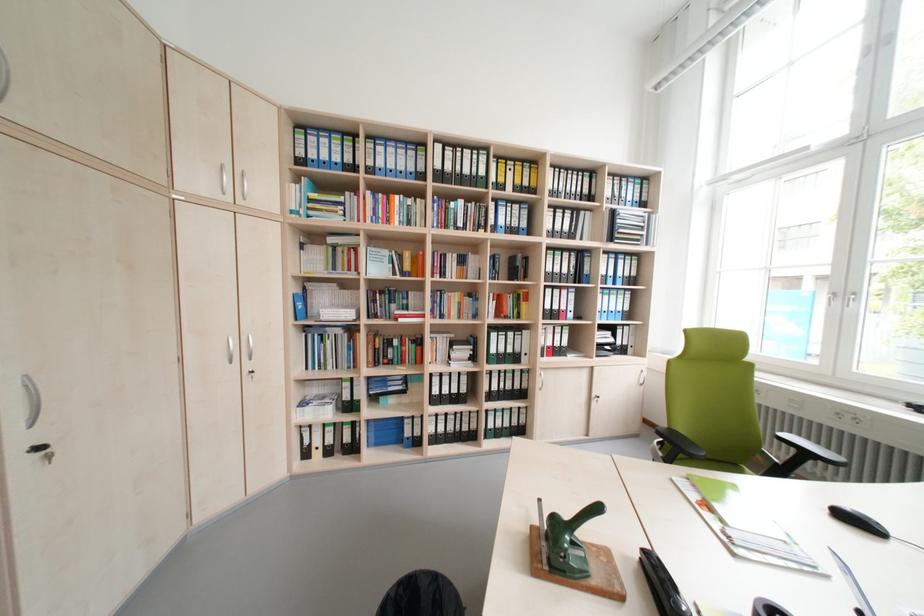
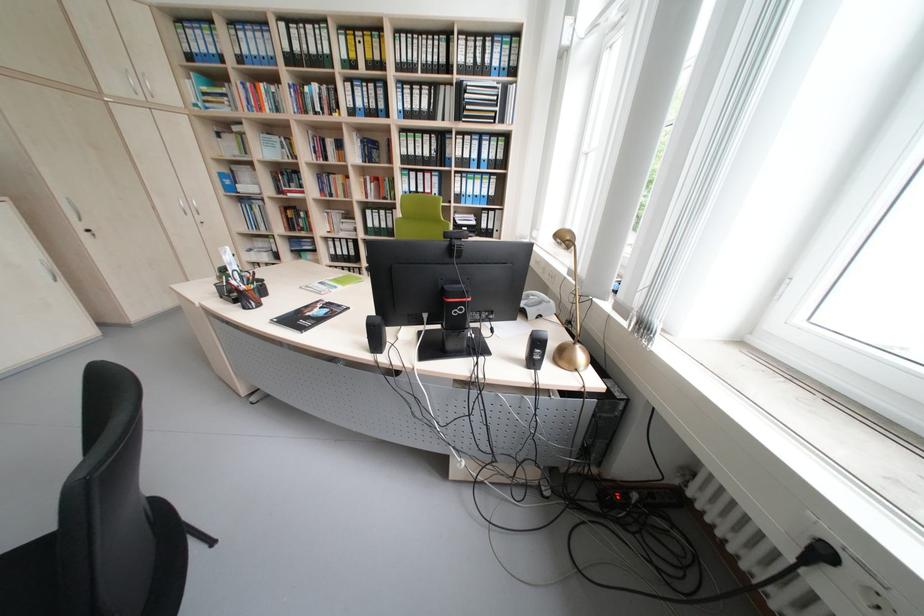
In the second image, find the point that corresponds to pixel 395 254 in the first image.

(286, 140)